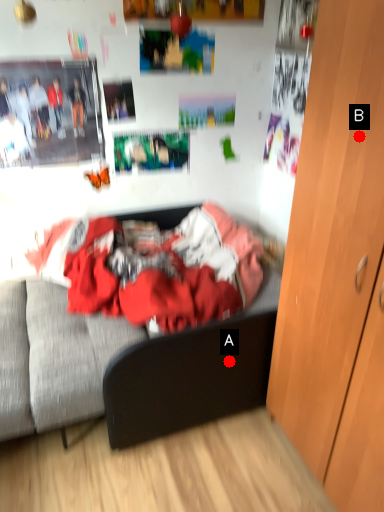
Question: Two points are circled on the image, labeled by A and B beside each circle. Among these points, which one is nearest to the camera?

Choices:
 (A) A is closer
 (B) B is closer

Answer: (B)